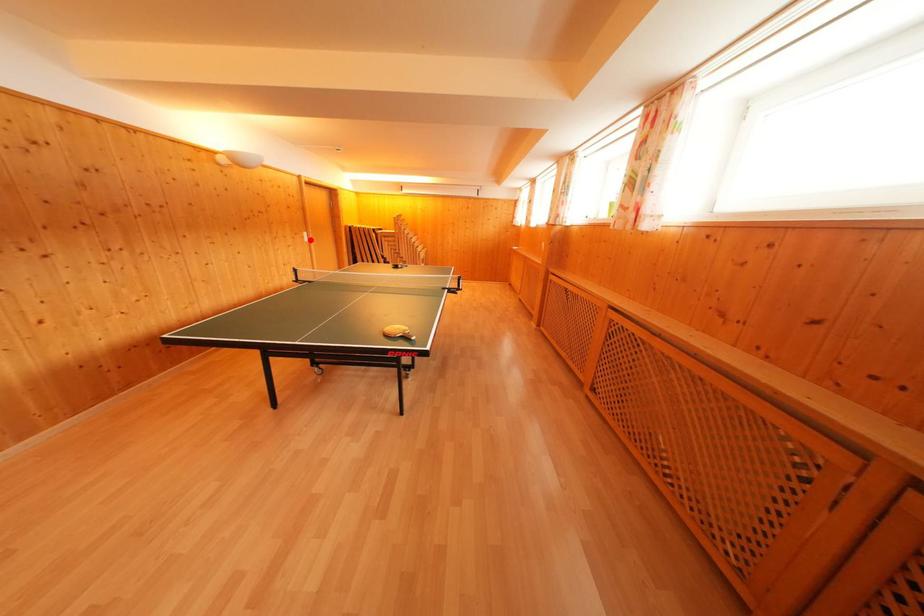
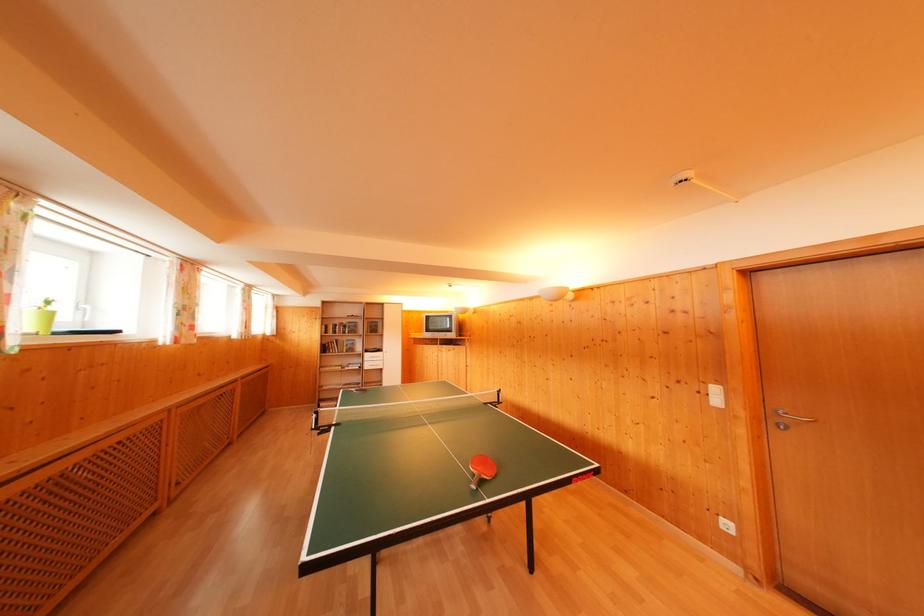
The point at the highlighted location is marked in the first image. Where is the corresponding point in the second image?

(721, 395)